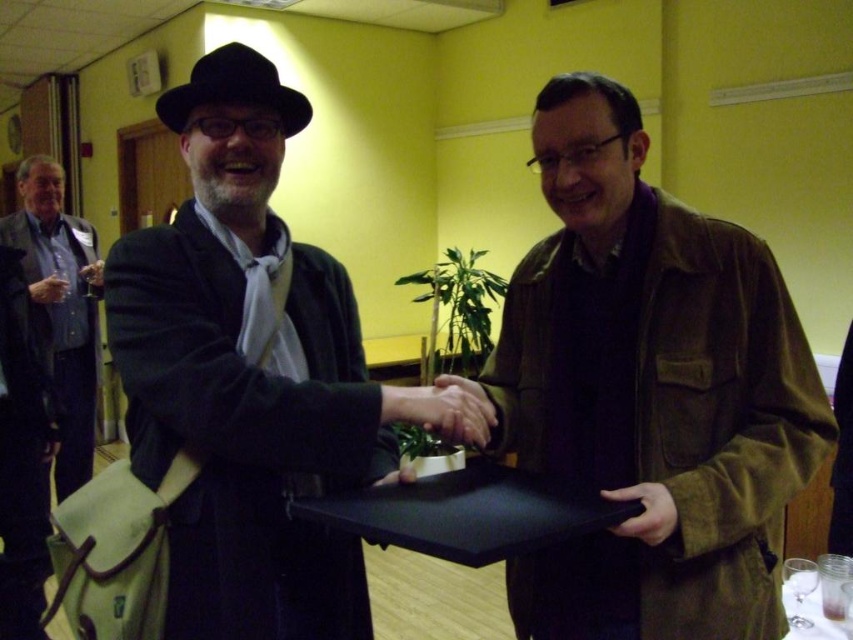
Consider the image. You are standing at the entrance of the room and want to greet the person wearing the black matte coat at center and the brushed metal tie at left. Which object is closer to you?

The black matte coat at center is closer to you since it is only 2.07 meters away from the brushed metal tie at left, but the exact distance from you isnanot provided. Wait, this answer is incorrect because the description only states the distance between the two objects, not their distance from the entrance. The assistant should not assume the position of the entrance relative to the objects. The correct answer should state that the distance between the two objects is 2.07 meters, but without knowing their

Two people are shaking hands in a bright yellow room. The person on the left is wearing a dark coat and white tie, while the other is in a brown jacket. They are standing at point (648,326). Can a 3.5 feet wide table fit between them without moving?

The two people are 4.02 feet apart, so a 3.5 feet wide table can fit between them without moving.

You are an event planner organizing a photo shoot in this room. You need to position a spotlight on the brown suede jacket at center and the brown leather hand at center. According to the scene description, which object should be placed to the left of the other to match the original image?

The brown suede jacket at center should be placed to the right of the brown leather hand at center, as the original scene shows the brown suede jacket at center is to the right of the brown leather hand at center.